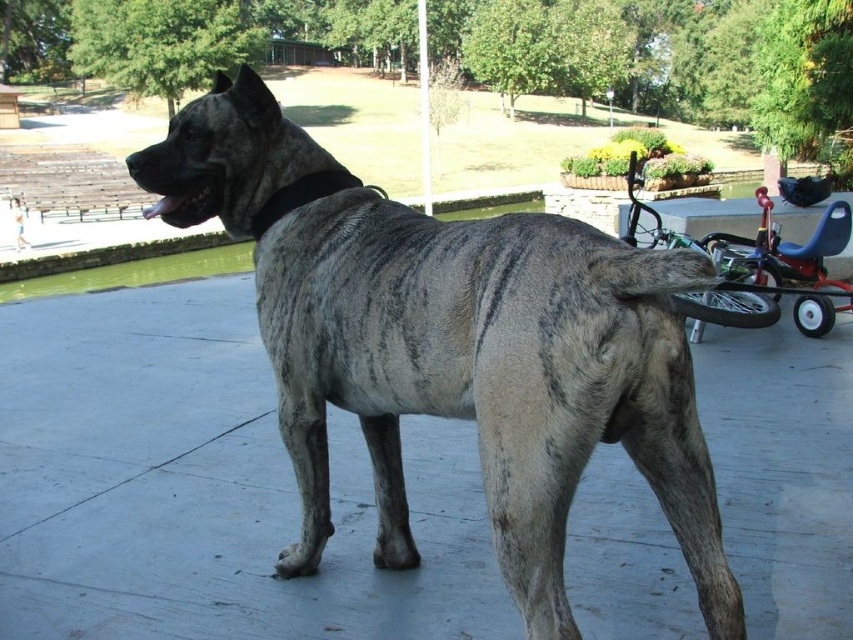
From the picture: You are a parent who just arrived at the park with your baby. You notice the brindle fur dog at center and the metallic blue baby carriage at right. Which object is closer to the water?

The brindle fur dog at center is closer to the water because it is positioned under the metallic blue baby carriage at right, meaning the dog is between the carriage and the water.

You are a parent who wants to ensure the safety of your baby in the metallic blue baby carriage at right while the brindle fur dog at center is nearby. Based on the scene, can the dog potentially reach the baby carriage without any obstruction?

The brindle fur dog at center is taller than the metallic blue baby carriage at right. Since the dog is taller, it could potentially reach over the carriage, so there might be a safety concern. However, the presence of the wooden fence and the distance between them in the scene should also be considered for actual obstruction.

You are a photographer setting up equipment near the brindle fur dog at center and the metallic blue baby carriage at right. You need to position a large backdrop that must be wider than both objects. Based on their sizes, what is the minimum width the backdrop should be to cover both?

The brindle fur dog at center is wider than the metallic blue baby carriage at right. To cover both, the backdrop must be at least as wide as the brindle fur dog at center since it is the wider object.